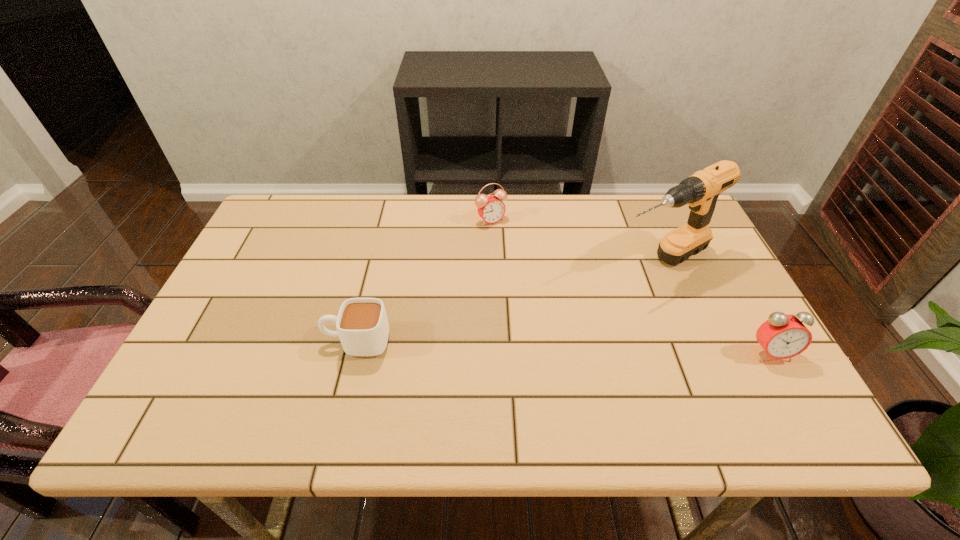
What are the coordinates of `blank space located on the clock face of the left alarm clock` in the screenshot? It's located at (521, 256).

This screenshot has height=540, width=960. I want to click on vacant region located 0.180m on the clock face of the left alarm clock, so click(x=526, y=262).

You are a GUI agent. You are given a task and a screenshot of the screen. Output one action in this format:
    pyautogui.click(x=<x>, y=<y>)
    Task: Click on the vacant position located 0.090m on the clock face of the left alarm clock
    
    Given the screenshot: What is the action you would take?
    pyautogui.click(x=512, y=244)

What are the coordinates of `vacant space located 0.210m at the tip of the third nearest object` in the screenshot? It's located at pos(560,307).

Where is `vacant space located at the tip of the third nearest object`? The width and height of the screenshot is (960, 540). vacant space located at the tip of the third nearest object is located at coordinates (565, 305).

You are a GUI agent. You are given a task and a screenshot of the screen. Output one action in this format:
    pyautogui.click(x=<x>, y=<y>)
    Task: Click on the blank space located at the tip of the third nearest object
    The height and width of the screenshot is (540, 960).
    Given the screenshot: What is the action you would take?
    pyautogui.click(x=498, y=340)

Identify the location of alarm clock at the far edge. Image resolution: width=960 pixels, height=540 pixels. point(491,209).

I want to click on drill situated at the far edge, so click(700, 192).

Where is `object positioned at the near edge`? The width and height of the screenshot is (960, 540). object positioned at the near edge is located at coordinates (782, 336).

The height and width of the screenshot is (540, 960). Identify the location of alarm clock that is at the right edge. (782, 336).